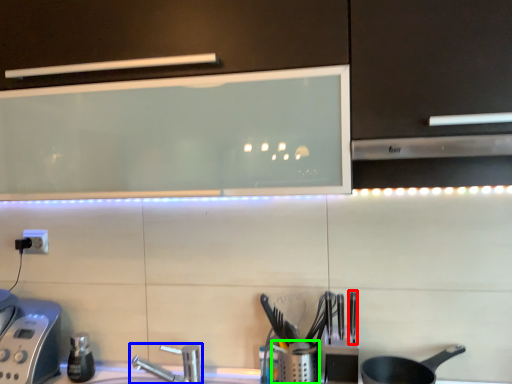
Question: Considering the real-world distances, which object is farthest from silverware (highlighted by a red box)? tap (highlighted by a blue box) or appliance (highlighted by a green box)?

Choices:
 (A) tap
 (B) appliance

Answer: (A)